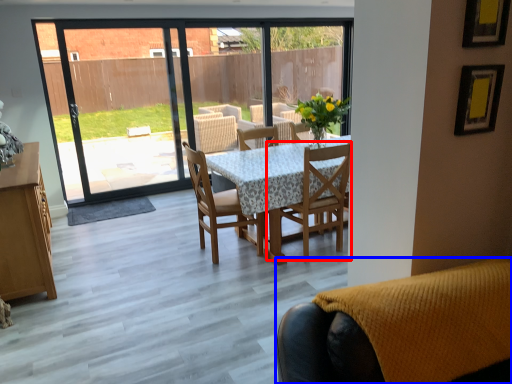
Question: Which point is closer to the camera, chair (highlighted by a red box) or chair (highlighted by a blue box)?

Choices:
 (A) chair
 (B) chair

Answer: (B)